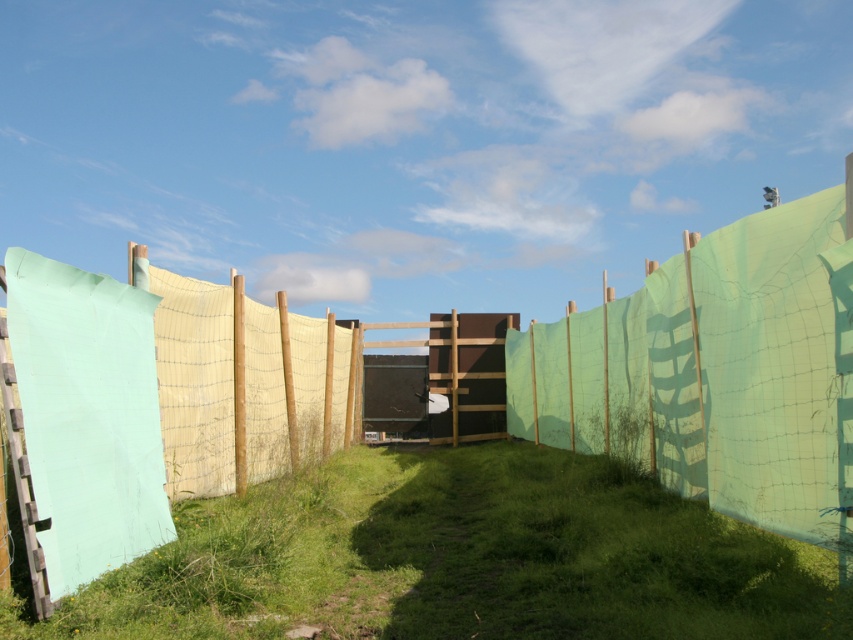
You are standing at the start of the pathway and want to reach the structure at the center. There are two green items in your path. Which one is closer to the structure? The green grassy at center or the green netting at center?

The green grassy at center is to the left of green netting at center, so the green netting at center is closer to the structure at the center of the image.

You are planning to lay a new path in the center of the scene. The current pathway is bordered by green grassy at center and green netting at center. Which of these two elements has a narrower width, making it the better choice for the new path?

The green grassy at center has a narrower width compared to the green netting at center, so it would be the better choice for the new path.

You are standing at the starting point of the pathway in the image. Looking ahead, there is a point marked at coordinates (457, 557). What is the color of the area where this point is located?

The point at coordinates (457, 557) corresponds to green grassy at center, so the area there is green.